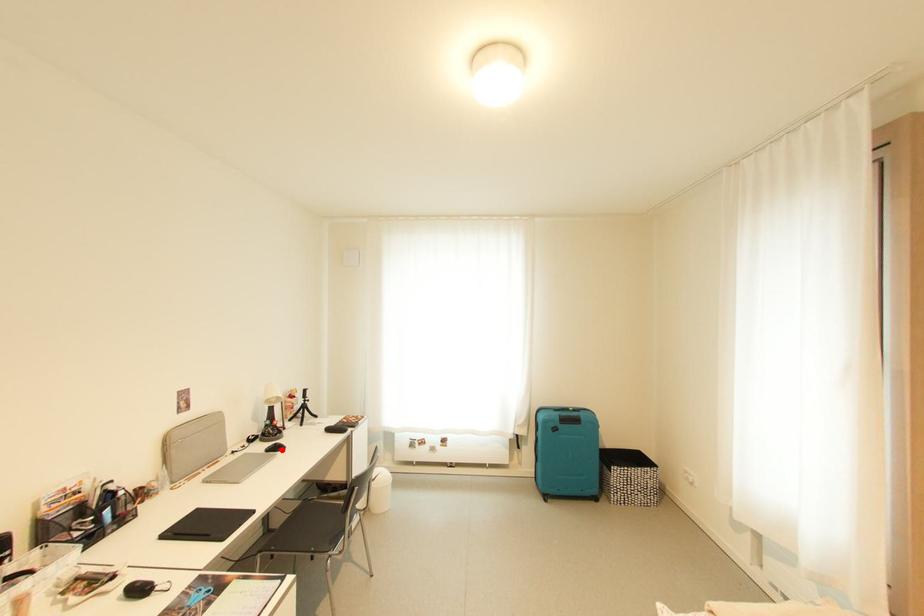
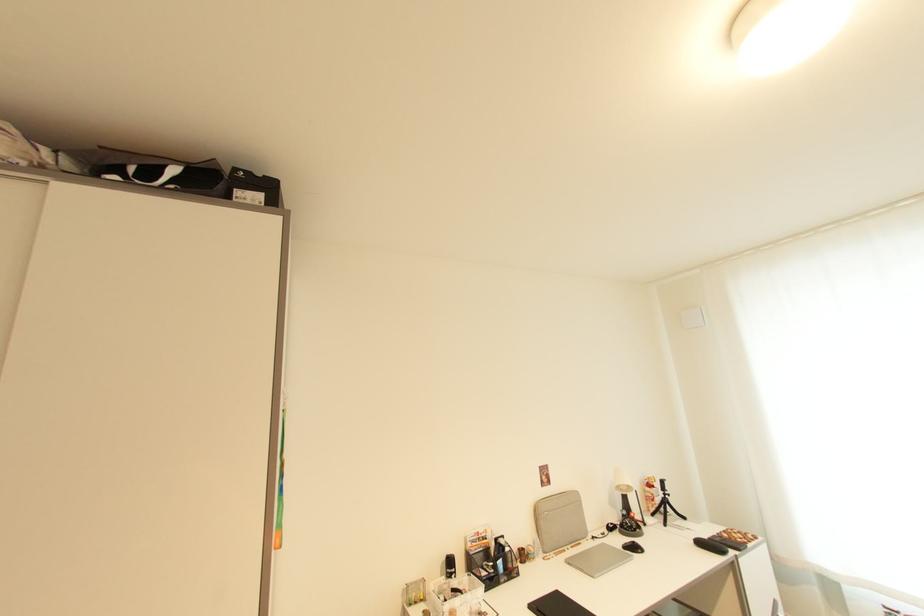
Where in the second image is the point corresponding to the highlighted location from the first image?

(639, 549)